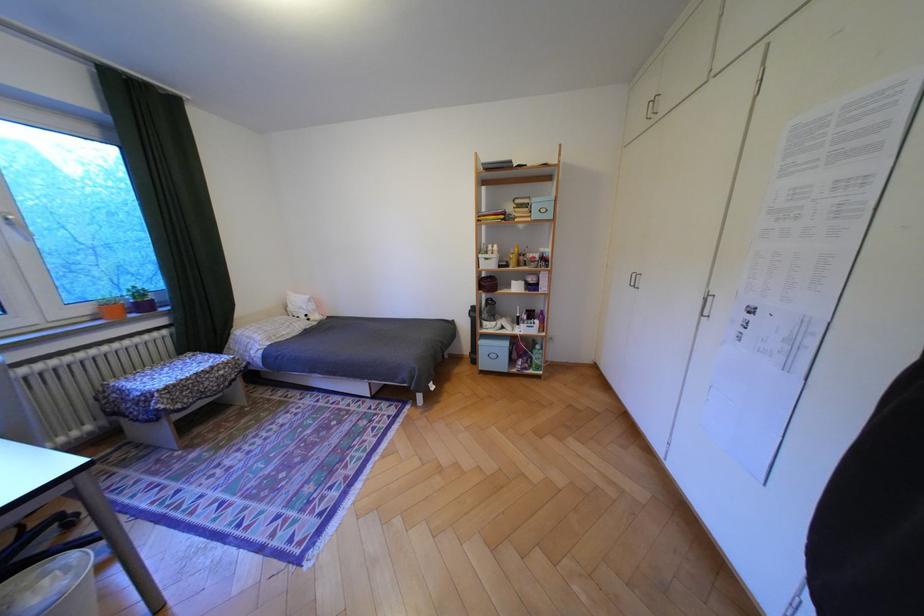
The height and width of the screenshot is (616, 924). I want to click on purple plant pot, so click(140, 300).